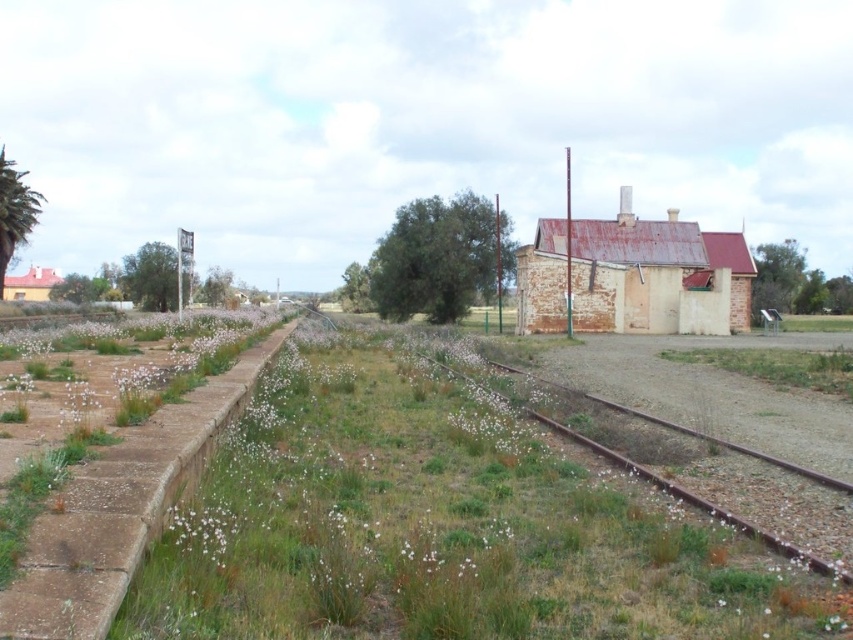
Question: Is green grass at center below rusty metal train track at center?

Choices:
 (A) yes
 (B) no

Answer: (B)

Question: Where is green grass at center located in relation to rusty metal train track at center in the image?

Choices:
 (A) below
 (B) above

Answer: (B)

Question: Is green grass at center thinner than rusty metal train track at center?

Choices:
 (A) yes
 (B) no

Answer: (B)

Question: Which object appears farthest from the camera in this image?

Choices:
 (A) green grass at center
 (B) rusty metal train track at center

Answer: (B)

Question: Among these objects, which one is nearest to the camera?

Choices:
 (A) green grass at center
 (B) rusty metal train track at center

Answer: (A)

Question: Which point is closer to the camera?

Choices:
 (A) pos(639,524)
 (B) pos(616,452)

Answer: (A)